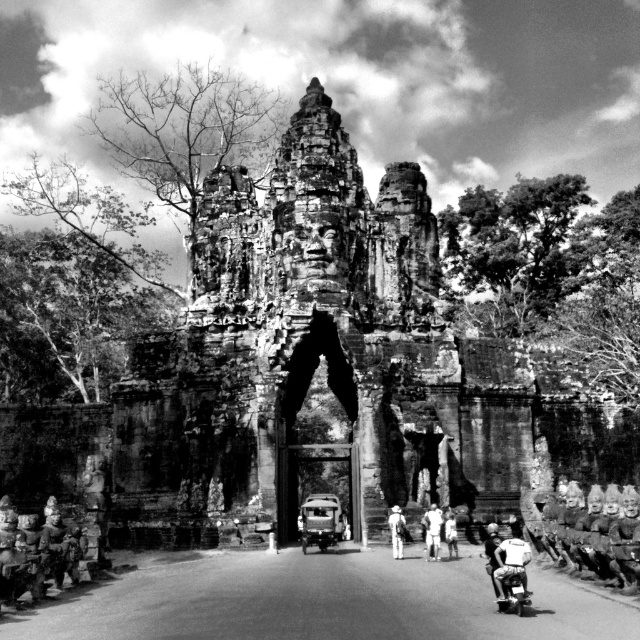
Question: Among these points, which one is nearest to the camera?

Choices:
 (A) (493, 589)
 (B) (444, 538)
 (C) (305, 288)
 (D) (429, 547)

Answer: (A)

Question: Does white cotton shirt at center lie in front of dark gray fabric person at center?

Choices:
 (A) no
 (B) yes

Answer: (A)

Question: Which object is the farthest from the white fabric shirt at lower center?

Choices:
 (A) white cotton shirt at center
 (B) white fabric hat at center
 (C) dark gray fabric person at center
 (D) light skin/white fabric person at center

Answer: (B)

Question: Does shiny metallic motorcycle at lower center appear under dark gray fabric person at center?

Choices:
 (A) no
 (B) yes

Answer: (A)

Question: Which point is farther from the camera taking this photo?

Choices:
 (A) (604, 468)
 (B) (508, 566)
 (C) (451, 532)
 (D) (525, 580)

Answer: (A)

Question: Does metallic car at center have a greater width compared to shiny metallic motorcycle at lower center?

Choices:
 (A) no
 (B) yes

Answer: (B)